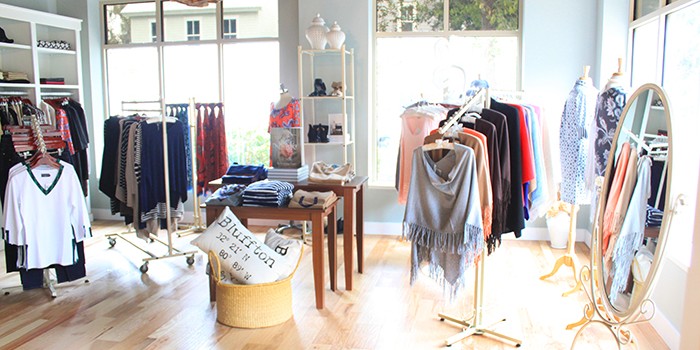
You are a GUI agent. You are given a task and a screenshot of the screen. Output one action in this format:
    pyautogui.click(x=<x>, y=<y>)
    Task: Click on the wood table
    
    Given the screenshot: What is the action you would take?
    pyautogui.click(x=315, y=232), pyautogui.click(x=350, y=200)